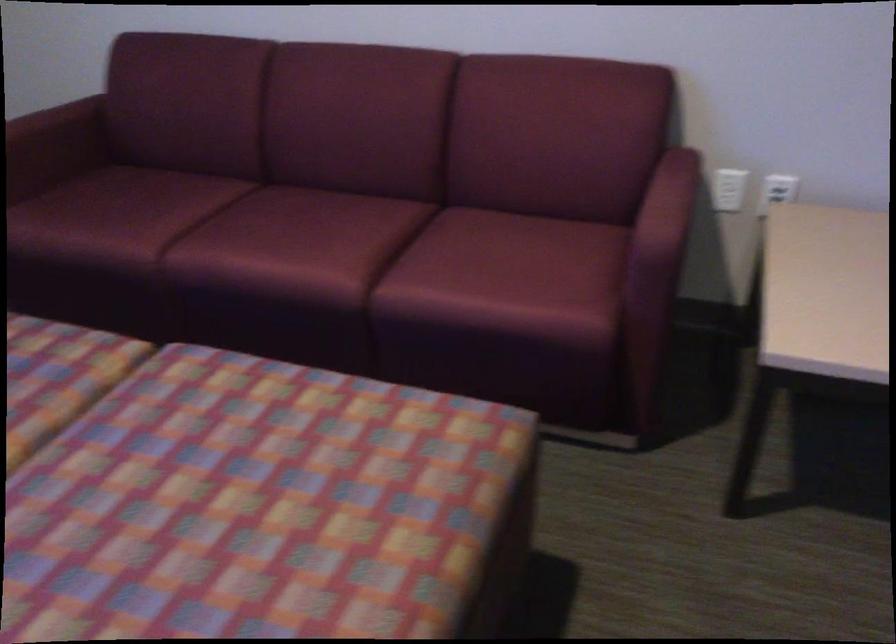
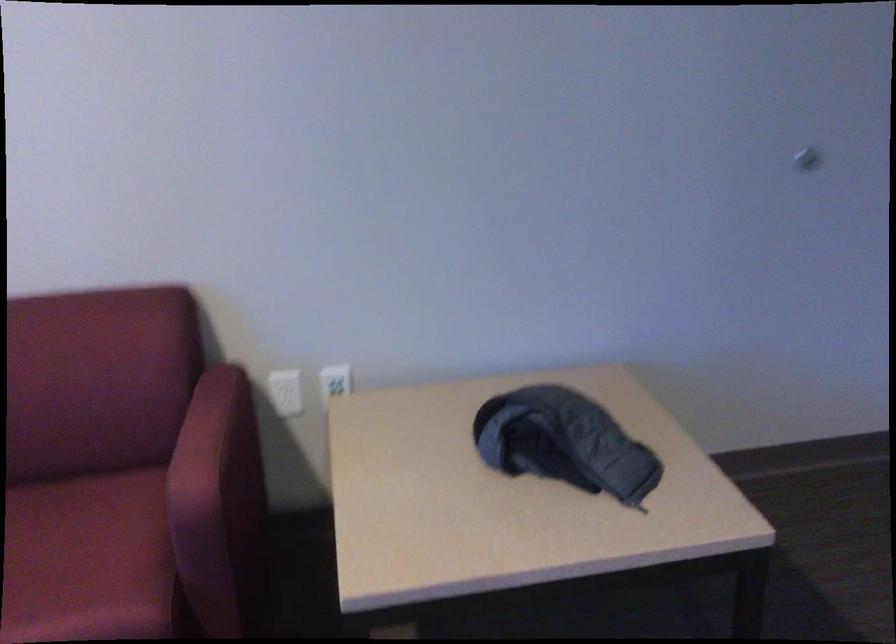
Find the pixel in the second image that matches the point at 771,190 in the first image.

(334, 382)